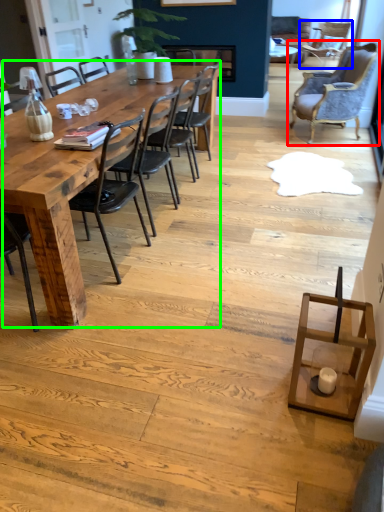
Question: Considering the real-world distances, which object is farthest from chair (highlighted by a red box)? chair (highlighted by a blue box) or kitchen & dining room table (highlighted by a green box)?

Choices:
 (A) chair
 (B) kitchen & dining room table

Answer: (B)